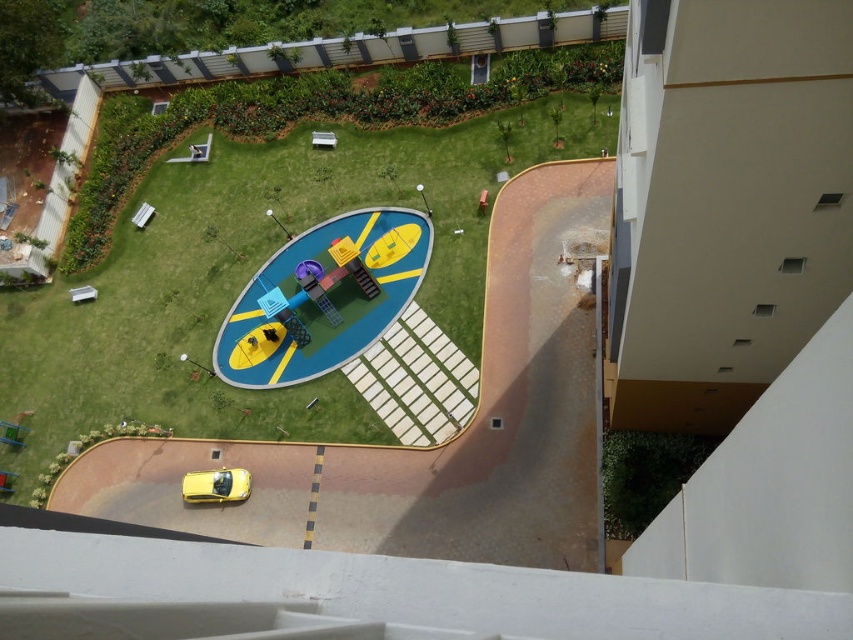
You are standing at the playground and want to reach the entrance of the residential complex. You see two points marked on the ground labeled as point (33, 339) and point (181, 493). According to the aerial view, which point is closer to the entrance if the entrance is located behind the playground?

Point (33, 339) is behind point (181, 493), so it is closer to the entrance located behind the playground.

You are a gardener who needs to mow the lawn. You see the green grass at center and the yellow matte car at lower left. Which area requires mowing first based on their heights?

The green grass at center requires mowing first because it is taller than the yellow matte car at lower left, indicating it needs maintenance.